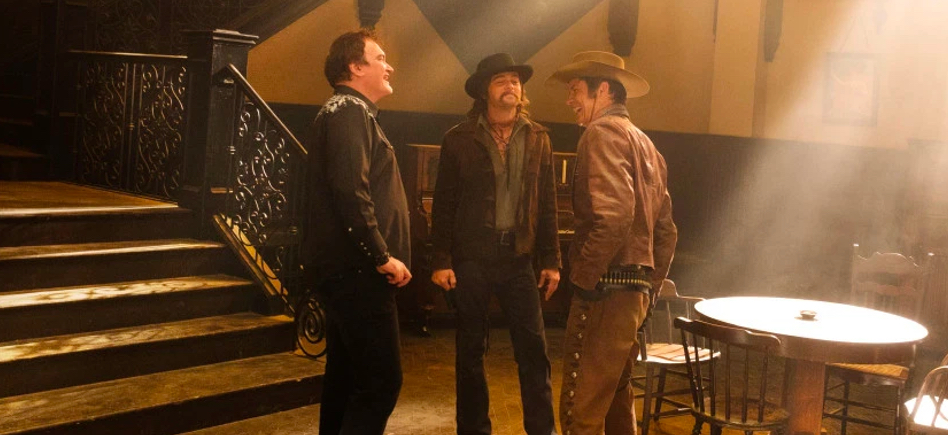
Identify the location of chairs. The width and height of the screenshot is (948, 435). (670, 354), (740, 409), (877, 377), (921, 406).